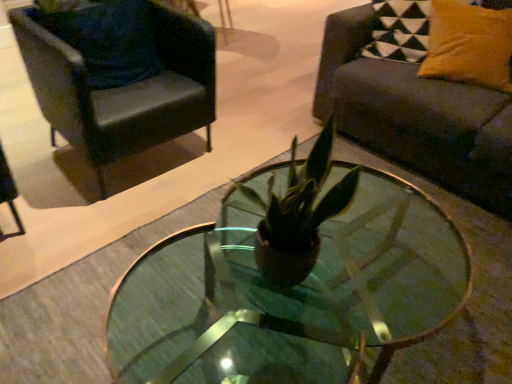
Question: Considering the relative sizes of black leather chair at upper left and transparent glass coffee table at center in the image provided, is black leather chair at upper left wider than transparent glass coffee table at center?

Choices:
 (A) no
 (B) yes

Answer: (A)

Question: Is black leather chair at upper left in contact with transparent glass coffee table at center?

Choices:
 (A) yes
 (B) no

Answer: (B)

Question: From the image's perspective, does black leather chair at upper left appear higher than transparent glass coffee table at center?

Choices:
 (A) yes
 (B) no

Answer: (A)

Question: Is black leather chair at upper left turned away from transparent glass coffee table at center?

Choices:
 (A) yes
 (B) no

Answer: (B)

Question: Does black leather chair at upper left have a greater height compared to transparent glass coffee table at center?

Choices:
 (A) no
 (B) yes

Answer: (B)

Question: From the image's perspective, relative to velvet yellow pillow at upper right, which is the 2th pillow from left to right, is transparent glass coffee table at center above or below?

Choices:
 (A) below
 (B) above

Answer: (A)

Question: Does point (237, 279) appear closer or farther from the camera than point (433, 8)?

Choices:
 (A) closer
 (B) farther

Answer: (A)

Question: Is transparent glass coffee table at center wider or thinner than velvet yellow pillow at upper right, the 1th pillow from the right?

Choices:
 (A) thin
 (B) wide

Answer: (B)

Question: Based on their sizes in the image, would you say transparent glass coffee table at center is bigger or smaller than velvet yellow pillow at upper right, which is the 2th pillow from left to right?

Choices:
 (A) small
 (B) big

Answer: (B)

Question: Is velvet dark blue pillow at upper left, marked as the 2th pillow in a right-to-left arrangement, spatially inside black leather chair at upper left, or outside of it?

Choices:
 (A) outside
 (B) inside

Answer: (B)

Question: In the image, is velvet dark blue pillow at upper left, marked as the 2th pillow in a right-to-left arrangement, on the left side or the right side of black leather chair at upper left?

Choices:
 (A) right
 (B) left

Answer: (B)

Question: In the image, is velvet dark blue pillow at upper left, positioned as the 1th pillow in left-to-right order, positioned in front of or behind black leather chair at upper left?

Choices:
 (A) behind
 (B) front

Answer: (A)

Question: From a real-world perspective, is velvet dark blue pillow at upper left, positioned as the 1th pillow in left-to-right order, physically located above or below black leather chair at upper left?

Choices:
 (A) above
 (B) below

Answer: (A)

Question: From their relative heights in the image, would you say black leather chair at upper left is taller or shorter than transparent glass coffee table at center?

Choices:
 (A) short
 (B) tall

Answer: (B)

Question: From the image's perspective, is black leather chair at upper left positioned above or below transparent glass coffee table at center?

Choices:
 (A) below
 (B) above

Answer: (B)